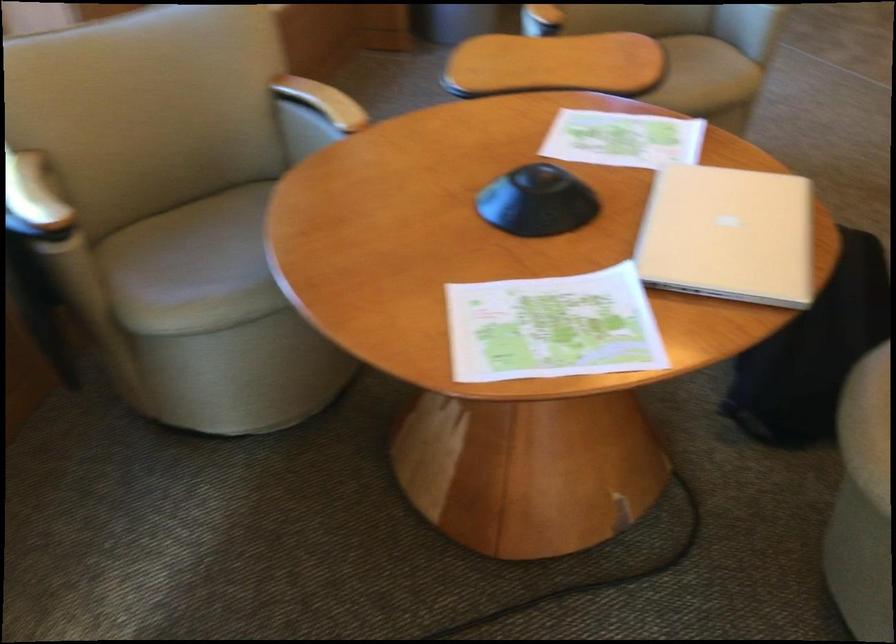
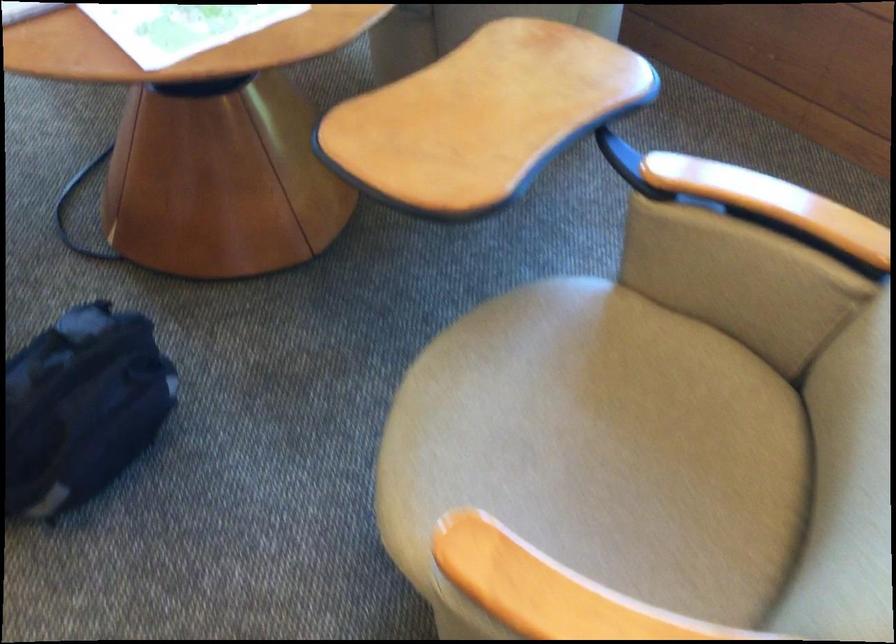
Question: I am providing you with two images of the same scene from different viewpoints. After the viewpoint changes to image2, which objects are now occluded?

Choices:
 (A) beige chair sitting surface
 (B) grey pen
 (C) pivoting wooden tray
 (D) chair sitting surface

Answer: (A)